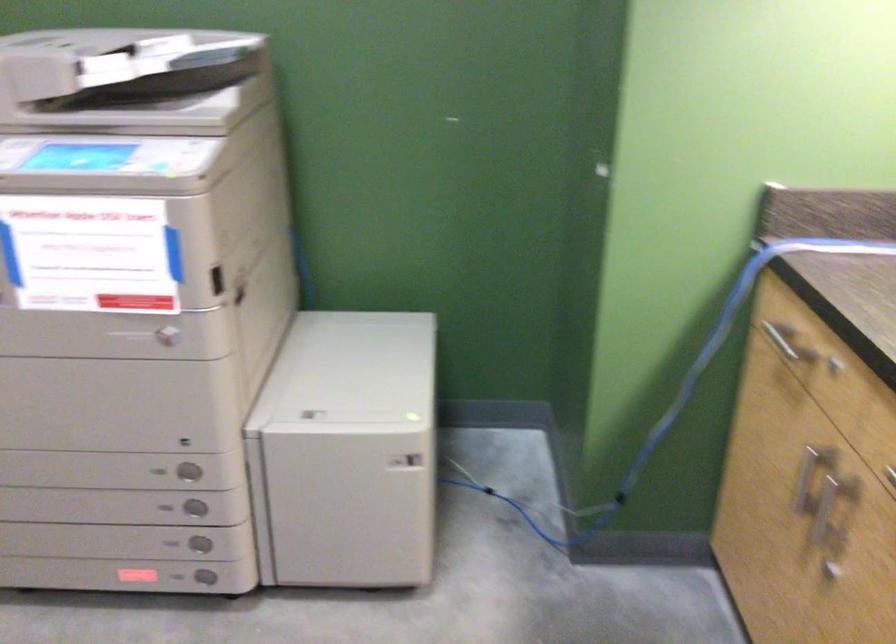
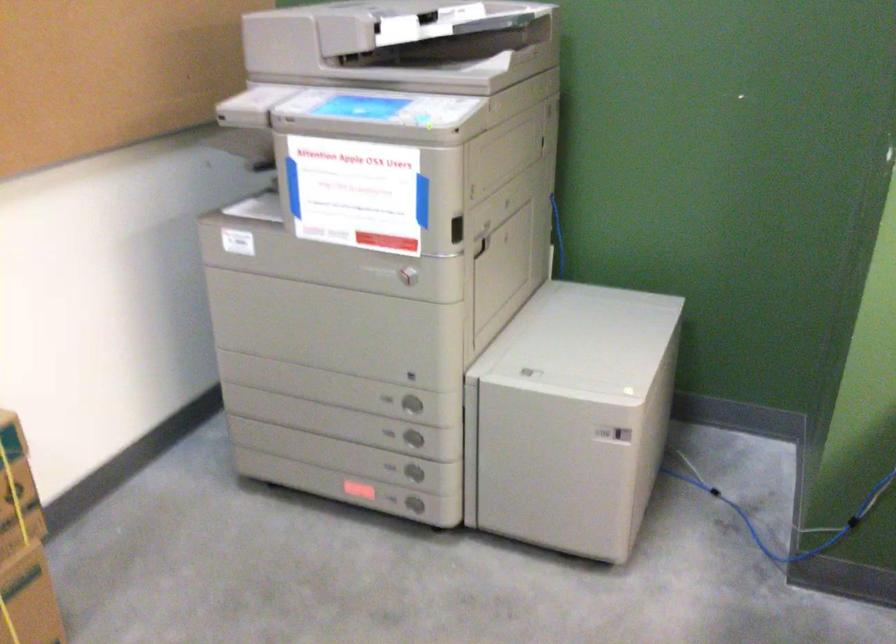
Question: In a continuous first-person perspective shot, in which direction is the camera moving?

Choices:
 (A) Left
 (B) Right
 (C) Forward
 (D) Backward

Answer: (B)